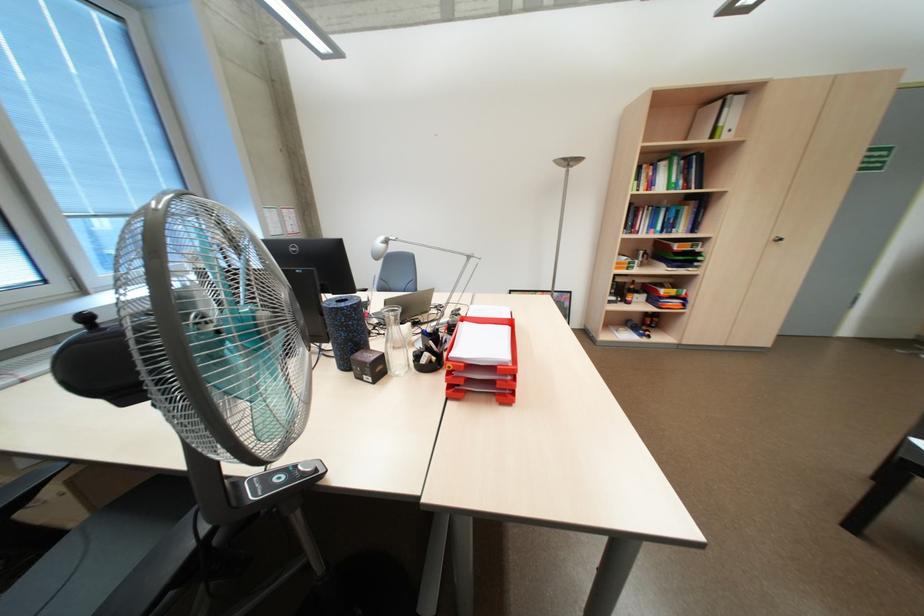
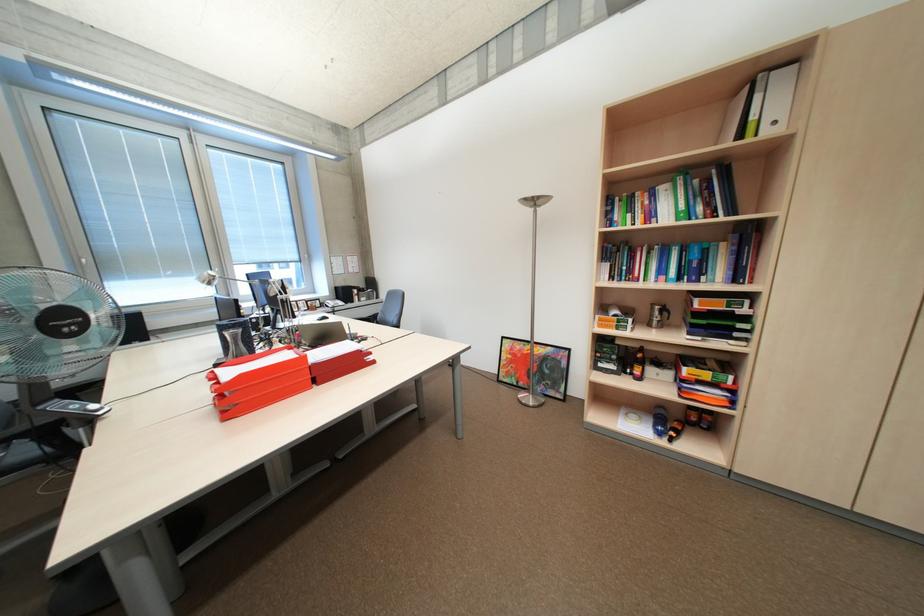
Where in the second image is the point corresponding to pixel 577 161 from the first image?

(542, 203)